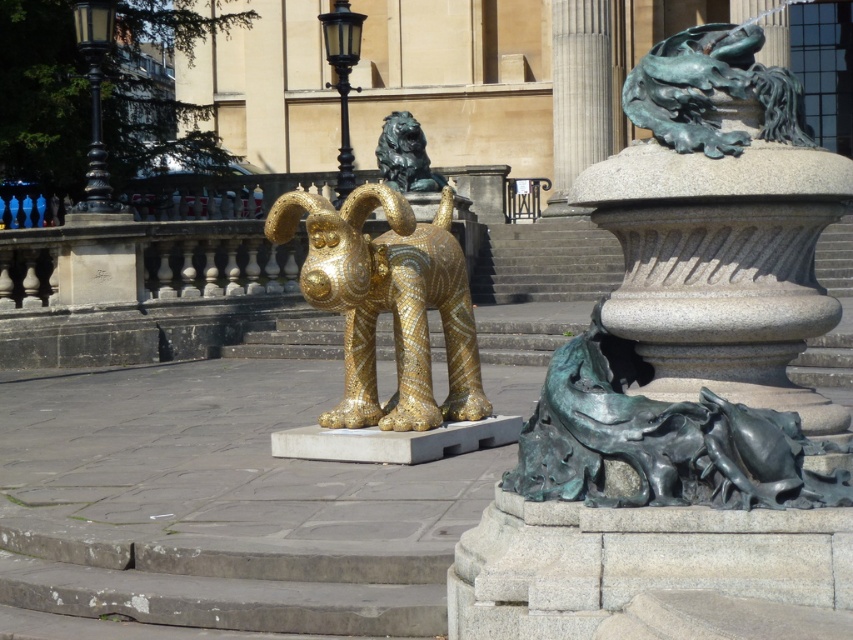
Question: Which object is farther from the camera taking this photo?

Choices:
 (A) gold mosaic ram at center
 (B) green patina bronze horse at lower right

Answer: (A)

Question: Does gold mosaic ram at center appear under green patina bronze dragon at upper right?

Choices:
 (A) yes
 (B) no

Answer: (A)

Question: Is gold mosaic ram at center further to camera compared to green patina bronze dragon at upper right?

Choices:
 (A) yes
 (B) no

Answer: (A)

Question: Which point is farther to the camera?

Choices:
 (A) (645, 58)
 (B) (714, 474)

Answer: (A)

Question: Can you confirm if green patina bronze horse at lower right is positioned below gold mosaic ram at center?

Choices:
 (A) yes
 (B) no

Answer: (A)

Question: Which point appears farthest from the camera in this image?

Choices:
 (A) (759, 497)
 (B) (682, 65)

Answer: (B)